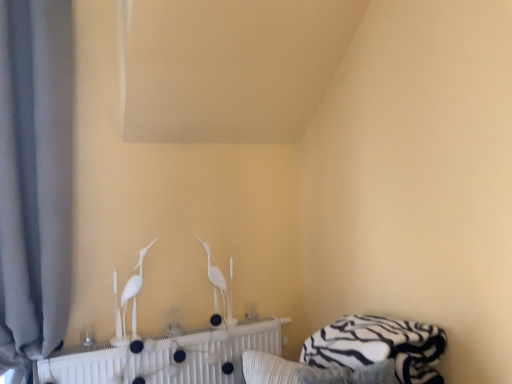
Question: Based on their sizes in the image, would you say white matte radiator at center is bigger or smaller than gray fabric curtain at left?

Choices:
 (A) small
 (B) big

Answer: (A)

Question: Considering the positions of white matte radiator at center and gray fabric curtain at left in the image, is white matte radiator at center wider or thinner than gray fabric curtain at left?

Choices:
 (A) wide
 (B) thin

Answer: (B)

Question: Based on their relative distances, which object is farther from the gray fabric curtain at left?

Choices:
 (A) white matte radiator at center
 (B) white glossy bird at center, positioned as the second bird in front-to-back order
 (C) white glossy bird at center, which ranks as the second bird in back-to-front order
 (D) white zebra-patterned bed at lower right

Answer: (D)

Question: Considering the real-world distances, which object is farthest from the white glossy bird at center, the 2th bird viewed from the left?

Choices:
 (A) gray fabric curtain at left
 (B) white glossy bird at center, which ranks as the second bird in back-to-front order
 (C) white matte radiator at center
 (D) white zebra-patterned bed at lower right

Answer: (A)